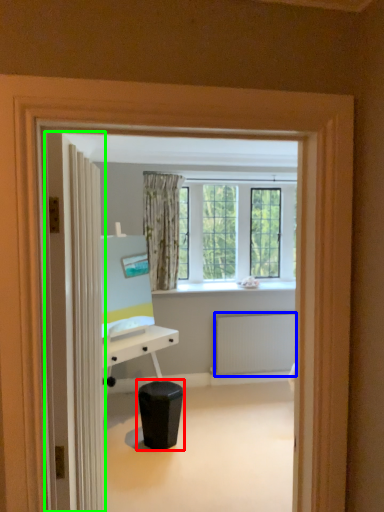
Question: Considering the real-world distances, which object is closest to music stool (highlighted by a red box)? radiator (highlighted by a blue box) or door (highlighted by a green box).

Choices:
 (A) radiator
 (B) door

Answer: (A)